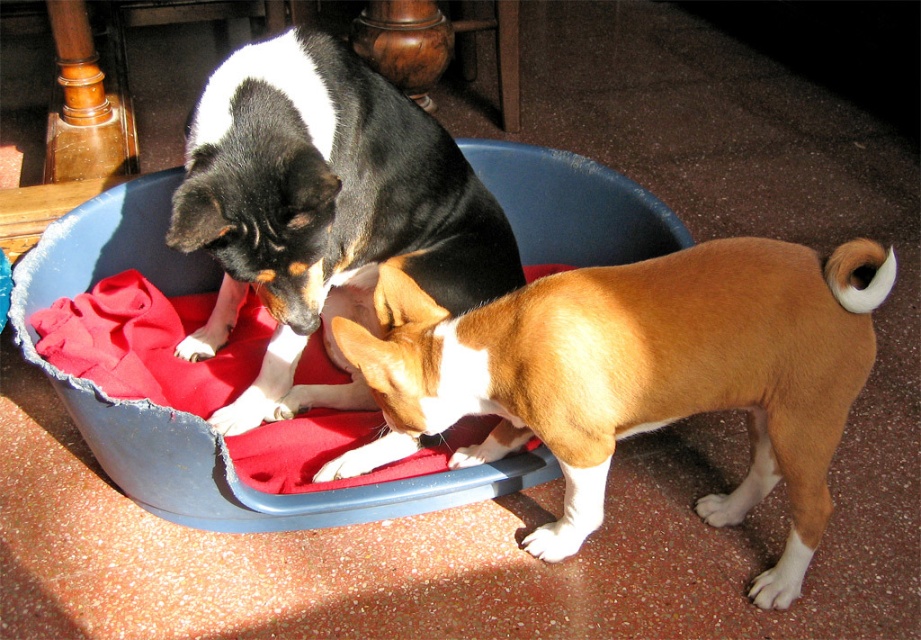
Question: Does brown/white fur dog at center appear over black and white fur dog at center?

Choices:
 (A) no
 (B) yes

Answer: (A)

Question: Is brown/white fur dog at center to the left of black and white fur dog at center from the viewer's perspective?

Choices:
 (A) no
 (B) yes

Answer: (A)

Question: Considering the relative positions of brown/white fur dog at center and black and white fur dog at center in the image provided, where is brown/white fur dog at center located with respect to black and white fur dog at center?

Choices:
 (A) below
 (B) above

Answer: (A)

Question: Which of the following is the closest to the observer?

Choices:
 (A) (578, 428)
 (B) (307, 132)

Answer: (A)

Question: Which object is farther from the camera taking this photo?

Choices:
 (A) brown/white fur dog at center
 (B) black and white fur dog at center

Answer: (B)